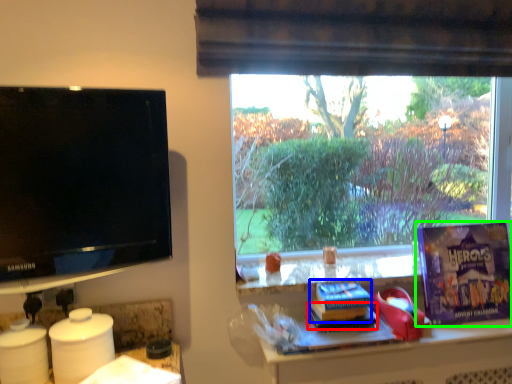
Question: Estimate the real-world distances between objects in this image. Which object is closer to book (highlighted by a red box), paperback book (highlighted by a blue box) or paperback book (highlighted by a green box)?

Choices:
 (A) paperback book
 (B) paperback book

Answer: (A)